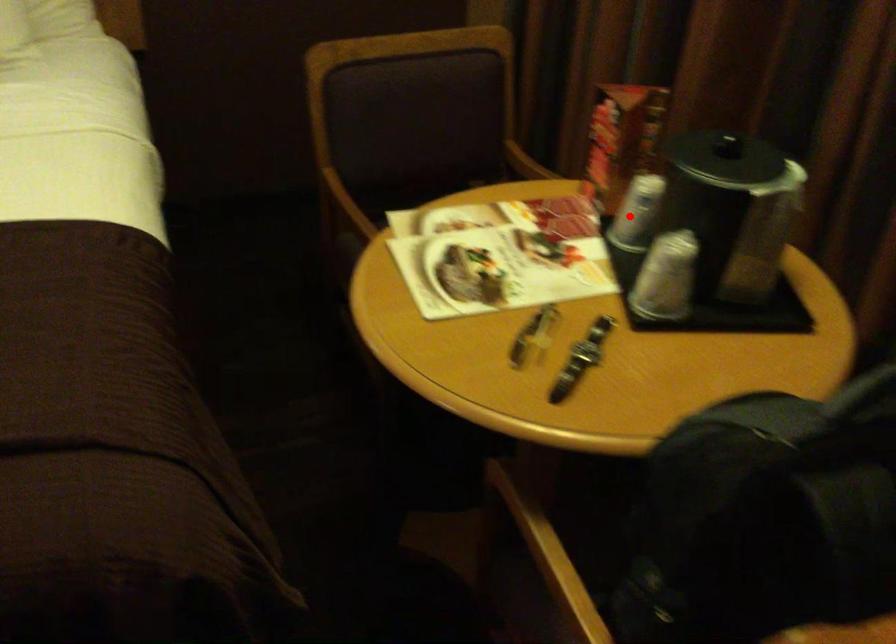
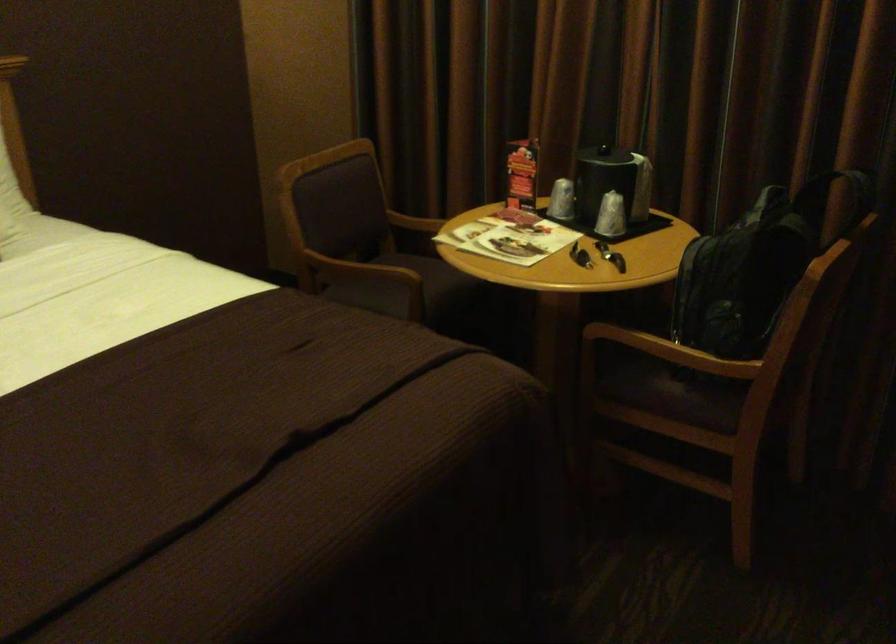
Question: A red point is marked in image1. In image2, is the corresponding 3D point closer to the camera or farther? Reply with the corresponding letter.

Choices:
 (A) The corresponding 3D point is closer.
 (B) The corresponding 3D point is farther.

Answer: (B)